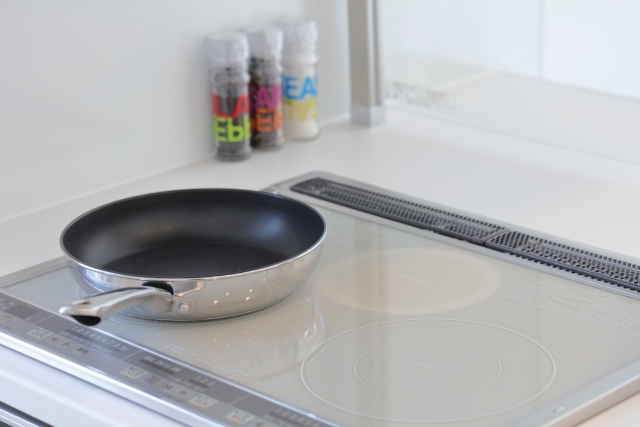
Show me all visible where you'd turn stove on in the image. Your answer should be formatted as a list of tuples, i.e. [(x1, y1), (x2, y2), ...], where each tuple contains the x and y coordinates of a point satisfying the conditions above.

[(6, 317), (65, 345), (179, 391), (248, 419)]